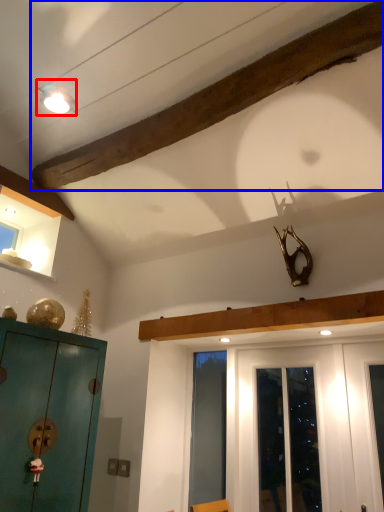
Question: Which object is further to the camera taking this photo, light fixture (highlighted by a red box) or molding (highlighted by a blue box)?

Choices:
 (A) light fixture
 (B) molding

Answer: (A)